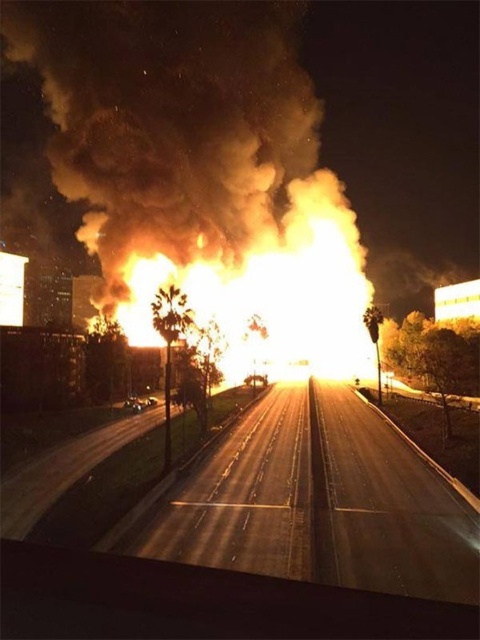
Does fluorescent orange smoke at center appear on the left side of smooth asphalt highway at center?

Correct, you'll find fluorescent orange smoke at center to the left of smooth asphalt highway at center.

Is point (123, 211) positioned behind point (373, 410)?

Yes, it is.

What do you see at coordinates (201, 170) in the screenshot? I see `fluorescent orange smoke at center` at bounding box center [201, 170].

Locate an element on the screen. The image size is (480, 640). fluorescent orange smoke at center is located at coordinates (201, 170).